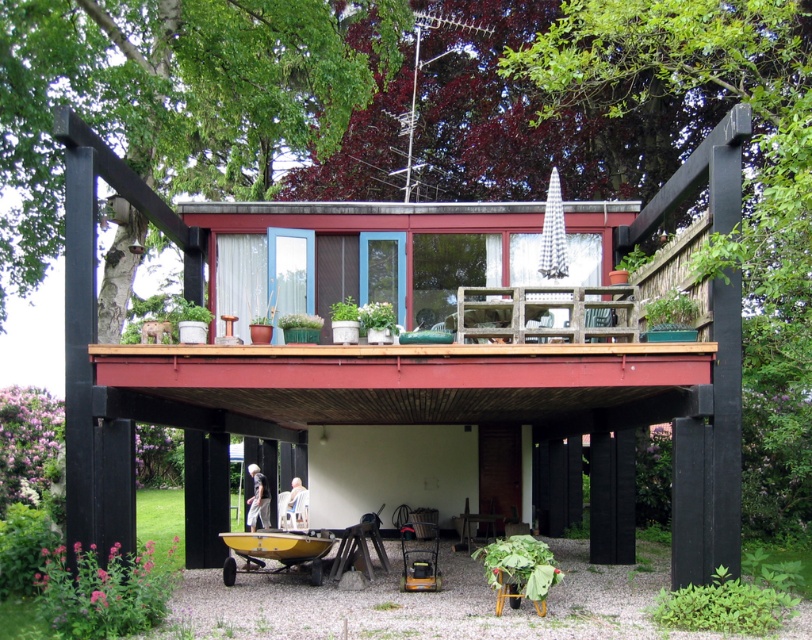
Consider the image. You are a guest at this modern house and want to sit down on the white fabric chair at lower center. However, you are wearing the light gray fabric pants at lower center. Is there enough space between you and the chair to sit comfortably without touching the pants?

The white fabric chair at lower center is 58.11 centimeters away from the light gray fabric pants at lower center. This distance is sufficient for sitting comfortably without touching the pants.

You are a delivery person trying to deliver a package to the house. The package requires a clear path between the black wood pergola at center and the front door located 9.73 meters away. Can you safely navigate this distance without obstacles?

The distance between the black wood pergola at center and the front door is 9.73 meters, so yes, you can safely navigate the path as there are no obstacles mentioned in the scene description.

You are planning to set up a small garden in the area between the black wood pergola at center and the light gray fabric pants at lower center. Considering their sizes, which object would allow more space for plants?

The black wood pergola at center has a larger width than the light gray fabric pants at lower center, so it would allow more space for plants.